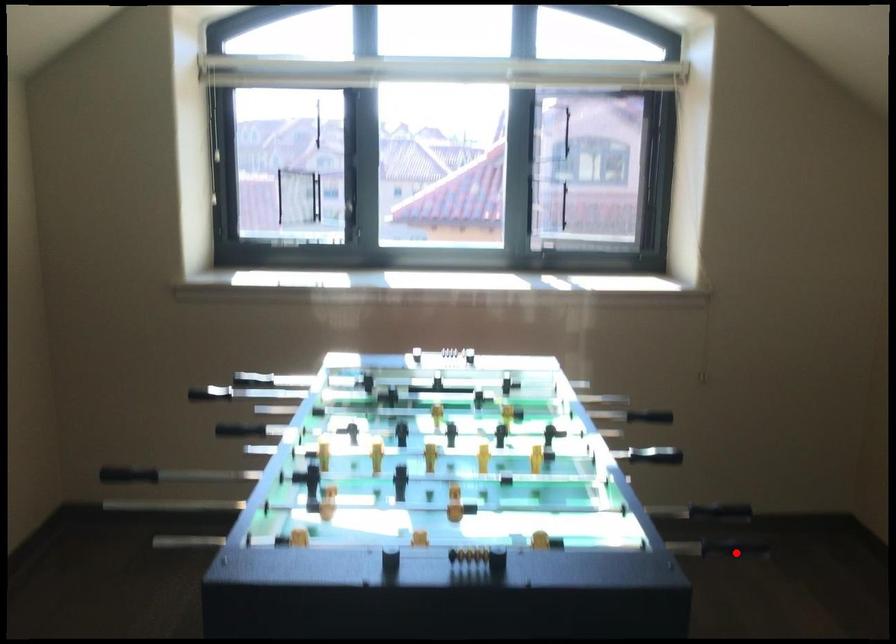
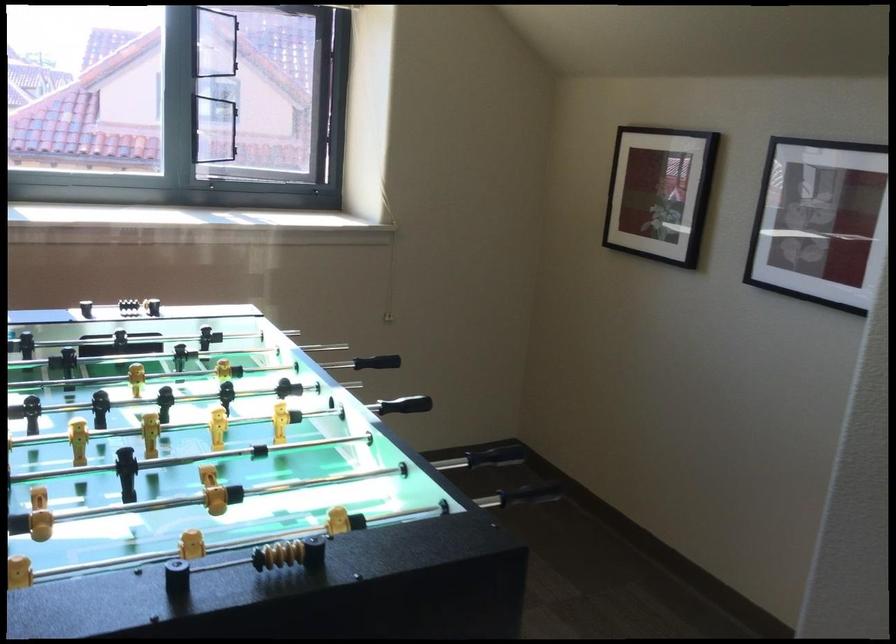
Find the pixel in the second image that matches the highlighted location in the first image.

(531, 493)